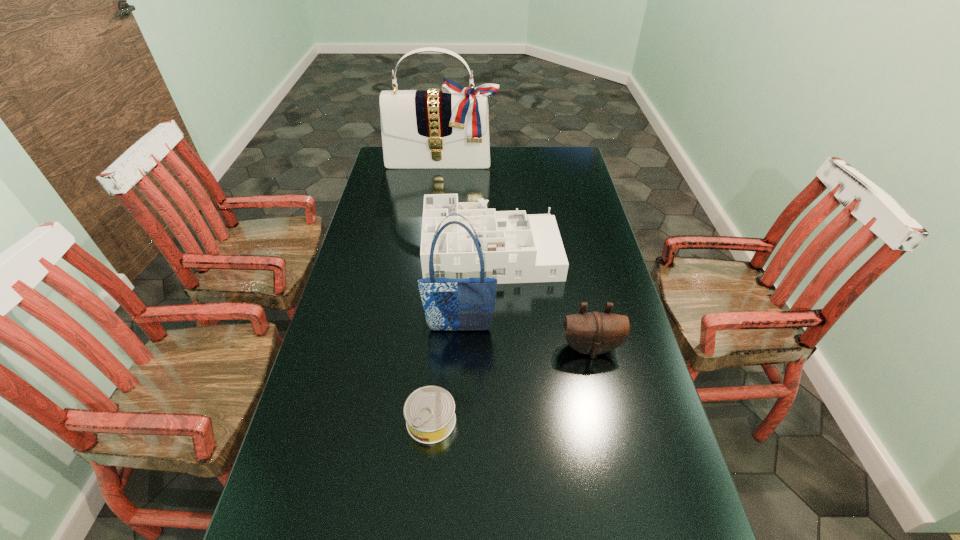
At what (x,y) coordinates should I click in order to perform the action: click on empty location between the nearest object and the pouch. Please return your answer as a coordinate pair (x, y). The image size is (960, 540). Looking at the image, I should click on (511, 384).

At what (x,y) coordinates should I click in order to perform the action: click on object that can be found as the third closest to the fourth shortest object. Please return your answer as a coordinate pair (x, y). The image size is (960, 540). Looking at the image, I should click on (429, 411).

Identify the location of object that is the second closest to the satchel. (450, 304).

At what (x,y) coordinates should I click in order to perform the action: click on free region that satisfies the following two spatial constraints: 1. on the front-facing side of the farthest object; 2. on the right side of the shortest object. Please return your answer as a coordinate pair (x, y). The width and height of the screenshot is (960, 540). Looking at the image, I should click on (411, 421).

The image size is (960, 540). What are the coordinates of `vacant region that satisfies the following two spatial constraints: 1. on the front-facing side of the farthest object; 2. on the left side of the dollhouse` in the screenshot? It's located at (431, 251).

Locate an element on the screen. The width and height of the screenshot is (960, 540). vacant area in the image that satisfies the following two spatial constraints: 1. on the front-facing side of the dollhouse; 2. on the right side of the satchel is located at coordinates (431, 251).